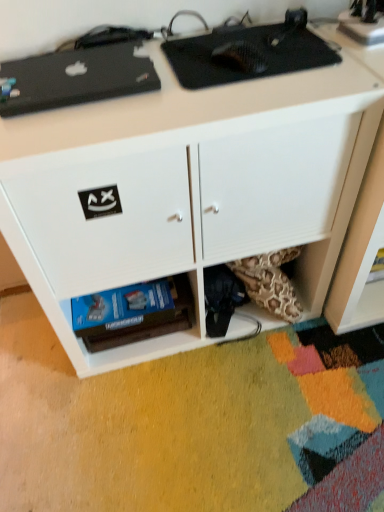
Where is `free space underneath black carbon fiber mouse pad at upper center, arranged as the second appliance when viewed from the left (from a real-world perspective)`? The width and height of the screenshot is (384, 512). free space underneath black carbon fiber mouse pad at upper center, arranged as the second appliance when viewed from the left (from a real-world perspective) is located at coordinates (239, 54).